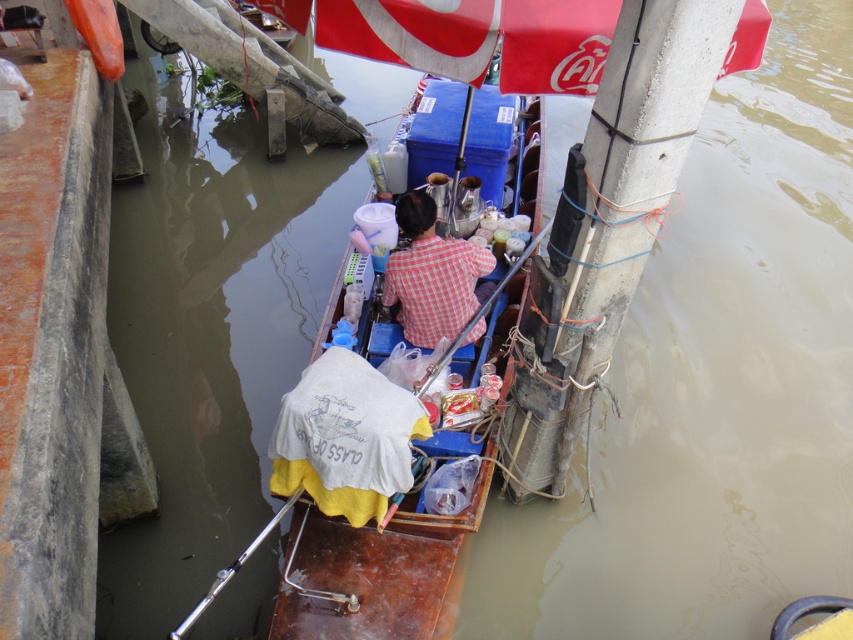
From the picture: You are standing on the dock and looking at the boat. There are two points marked on the boat. Which point is closer to you, point (363, 541) or point (418, 227)?

Point (363, 541) is closer to the camera than point (418, 227), so it is closer to you.

You are a customer at the floating market and want to approach the vendor wearing the red checkered shirt at center. Which direction should you move relative to the rusty wood boat at center to reach them?

The rusty wood boat at center is to the left of the red checkered shirt at center, so to reach the vendor, you should move to the right side of the rusty wood boat at center.